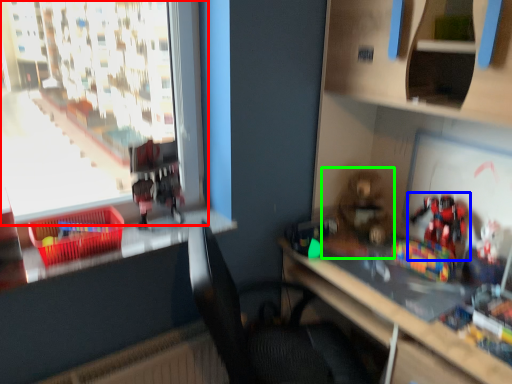
Question: Which is nearer to the window (highlighted by a red box)? toy (highlighted by a blue box) or toy (highlighted by a green box).

Choices:
 (A) toy
 (B) toy

Answer: (B)